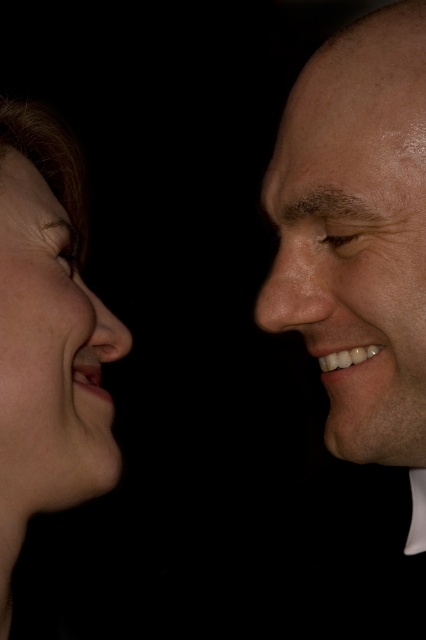
You are a photographer adjusting the lighting for a portrait session. You need to ensure that the light source is positioned so that it illuminates the smooth skin face at right properly. Given that the light source should be placed at point coordinates that are exactly 0.1 units to the left of the point indicated by point (362, 260), what would be the correct x and y coordinates for the light source?

The correct coordinates for the light source would be x 0.308 and y 0.850, since moving 0.1 units to the left from point (362, 260) subtracts 0.1 from the x coordinate while keeping the y coordinate the same.

You are a photographer adjusting the lighting for a portrait session. You notice the smooth skin face at right and the matte skin face at left in your frame. Since lighting affects different skin types, which face might require more careful adjustment to avoid harsh shadows?

The matte skin face at left might require more careful adjustment because matte skin tends to show more texture and can cast harsher shadows under certain lighting conditions compared to the smooth skin face at right.

You are a photographer adjusting the focus on a camera. You notice two points in the image labeled as point (382, 74) and point (106, 344). Which point should you focus on to ensure the person closer to the camera is in sharp focus?

Point (382, 74) is closer to the camera than point (106, 344), so you should focus on point (382, 74) to ensure the person closer to the camera is in sharp focus.